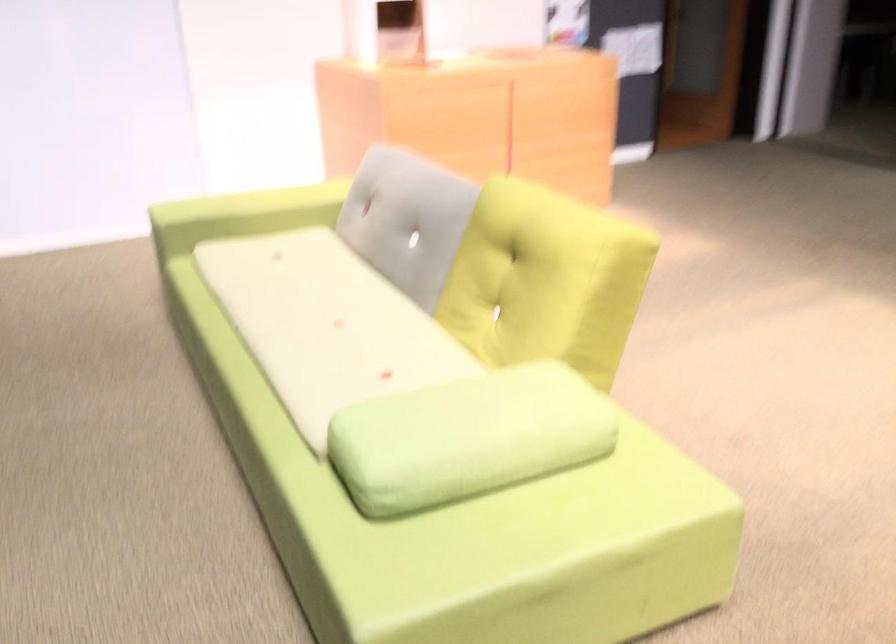
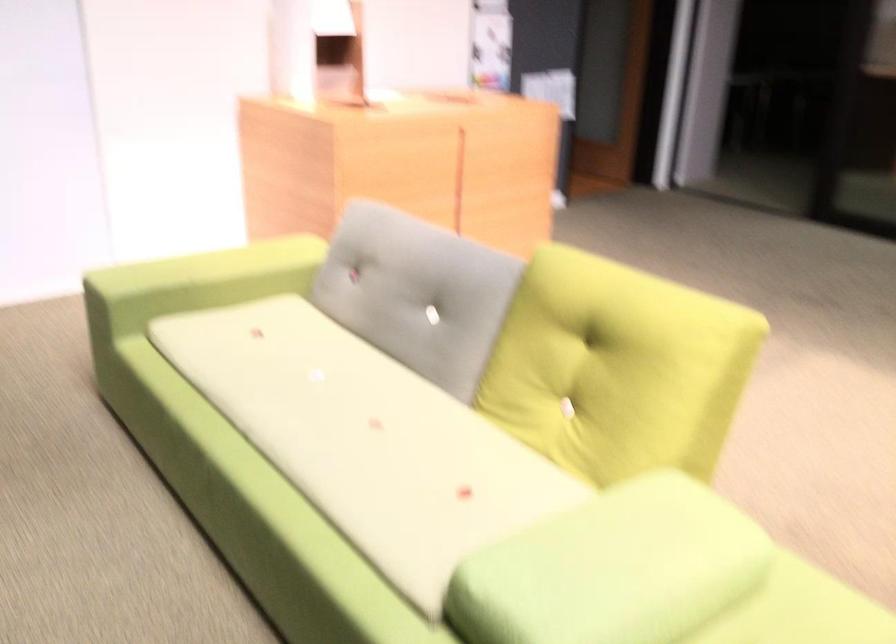
In the second image, find the point that corresponds to point (444, 422) in the first image.

(613, 569)